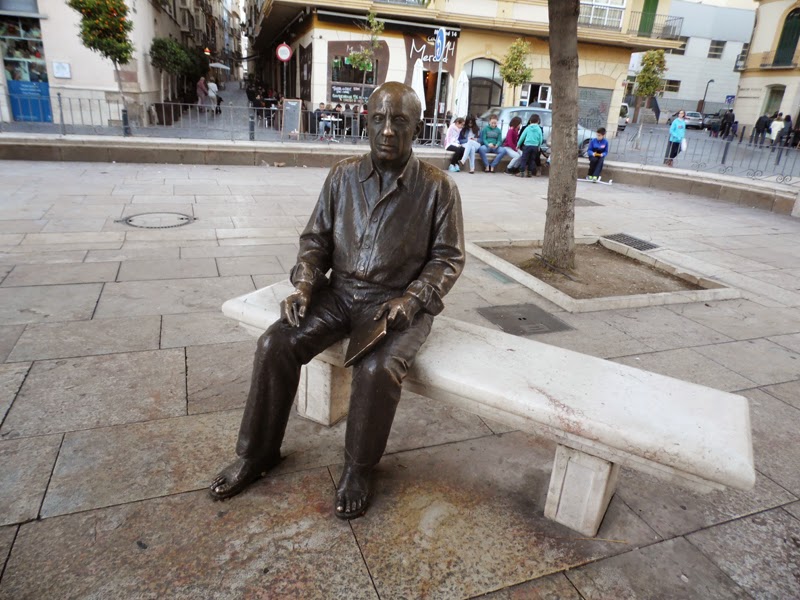
I want to click on statue, so tap(380, 215).